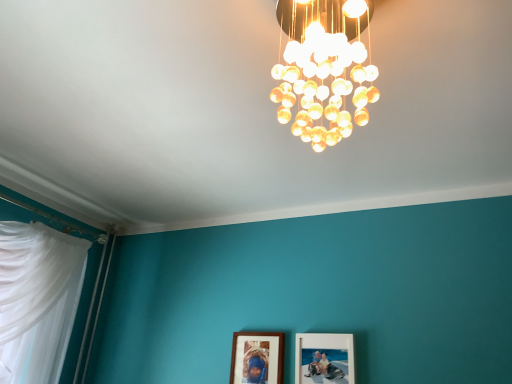
Question: Is translucent glass chandelier at upper center positioned far away from wooden picture frame at center, the first picture frame when ordered from left to right?

Choices:
 (A) no
 (B) yes

Answer: (B)

Question: Is the depth of translucent glass chandelier at upper center less than that of wooden picture frame at center, the first picture frame when ordered from left to right?

Choices:
 (A) no
 (B) yes

Answer: (B)

Question: Does translucent glass chandelier at upper center come behind wooden picture frame at center, the first picture frame when ordered from left to right?

Choices:
 (A) no
 (B) yes

Answer: (A)

Question: Is translucent glass chandelier at upper center facing towards wooden picture frame at center, acting as the 2th picture frame starting from the right?

Choices:
 (A) yes
 (B) no

Answer: (B)

Question: Is translucent glass chandelier at upper center positioned beyond the bounds of wooden picture frame at center, acting as the 2th picture frame starting from the right?

Choices:
 (A) no
 (B) yes

Answer: (B)

Question: Is wooden picture frame at center, the first picture frame when ordered from left to right, to the left or to the right of matte wooden picture frame at lower center, which is counted as the first picture frame, starting from the right, in the image?

Choices:
 (A) left
 (B) right

Answer: (A)

Question: Does point (266, 365) appear closer or farther from the camera than point (335, 340)?

Choices:
 (A) farther
 (B) closer

Answer: (A)

Question: Considering the positions of wooden picture frame at center, acting as the 2th picture frame starting from the right, and matte wooden picture frame at lower center, which is counted as the first picture frame, starting from the right, in the image, is wooden picture frame at center, acting as the 2th picture frame starting from the right, taller or shorter than matte wooden picture frame at lower center, which is counted as the first picture frame, starting from the right,?

Choices:
 (A) short
 (B) tall

Answer: (A)

Question: From a real-world perspective, relative to matte wooden picture frame at lower center, which is counted as the first picture frame, starting from the right, is wooden picture frame at center, the first picture frame when ordered from left to right, vertically above or below?

Choices:
 (A) below
 (B) above

Answer: (A)

Question: Considering their positions, is wooden picture frame at center, acting as the 2th picture frame starting from the right, located in front of or behind translucent glass chandelier at upper center?

Choices:
 (A) behind
 (B) front

Answer: (A)

Question: From a real-world perspective, relative to translucent glass chandelier at upper center, is wooden picture frame at center, the first picture frame when ordered from left to right, vertically above or below?

Choices:
 (A) above
 (B) below

Answer: (B)

Question: Is point (243, 332) closer or farther from the camera than point (308, 104)?

Choices:
 (A) farther
 (B) closer

Answer: (A)

Question: In terms of size, does wooden picture frame at center, acting as the 2th picture frame starting from the right, appear bigger or smaller than translucent glass chandelier at upper center?

Choices:
 (A) small
 (B) big

Answer: (A)

Question: Is translucent glass chandelier at upper center bigger or smaller than wooden picture frame at center, acting as the 2th picture frame starting from the right?

Choices:
 (A) big
 (B) small

Answer: (A)

Question: From the image's perspective, is translucent glass chandelier at upper center above or below wooden picture frame at center, the first picture frame when ordered from left to right?

Choices:
 (A) above
 (B) below

Answer: (A)